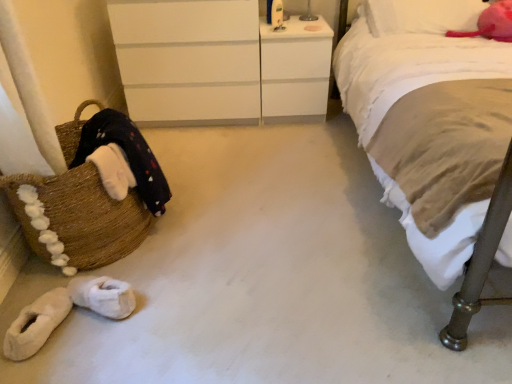
Question: Is white fluffy slippers at lower left, which is the second footwear in right-to-left order, not close to white fluffy slippers at lower left, placed as the 2th footwear when sorted from left to right?

Choices:
 (A) yes
 (B) no

Answer: (B)

Question: Is white fluffy slippers at lower left, the first footwear from the left, not inside white fluffy slippers at lower left, the first footwear positioned from the right?

Choices:
 (A) no
 (B) yes

Answer: (B)

Question: From the image's perspective, is white fluffy slippers at lower left, the first footwear from the left, over white fluffy slippers at lower left, placed as the 2th footwear when sorted from left to right?

Choices:
 (A) yes
 (B) no

Answer: (B)

Question: Is white fluffy slippers at lower left, the first footwear from the left, to the right of white fluffy slippers at lower left, the first footwear positioned from the right, from the viewer's perspective?

Choices:
 (A) no
 (B) yes

Answer: (A)

Question: Considering the relative sizes of white fluffy slippers at lower left, which is the second footwear in right-to-left order, and white fluffy slippers at lower left, placed as the 2th footwear when sorted from left to right, in the image provided, is white fluffy slippers at lower left, which is the second footwear in right-to-left order, smaller than white fluffy slippers at lower left, placed as the 2th footwear when sorted from left to right,?

Choices:
 (A) yes
 (B) no

Answer: (B)

Question: Is white fluffy slippers at lower left, which is the second footwear in right-to-left order, beside white fluffy slippers at lower left, placed as the 2th footwear when sorted from left to right?

Choices:
 (A) no
 (B) yes

Answer: (A)

Question: Is white glossy vanity at upper center further to camera compared to white fluffy slippers at lower left, placed as the 2th footwear when sorted from left to right?

Choices:
 (A) no
 (B) yes

Answer: (B)

Question: Considering the relative positions of white glossy vanity at upper center and white fluffy slippers at lower left, placed as the 2th footwear when sorted from left to right, in the image provided, is white glossy vanity at upper center to the right of white fluffy slippers at lower left, placed as the 2th footwear when sorted from left to right, from the viewer's perspective?

Choices:
 (A) yes
 (B) no

Answer: (A)

Question: From the image's perspective, is white glossy vanity at upper center located above white fluffy slippers at lower left, the first footwear positioned from the right?

Choices:
 (A) no
 (B) yes

Answer: (B)

Question: Does white glossy vanity at upper center have a greater height compared to white fluffy slippers at lower left, placed as the 2th footwear when sorted from left to right?

Choices:
 (A) yes
 (B) no

Answer: (A)

Question: Is white glossy vanity at upper center not close to white fluffy slippers at lower left, the first footwear positioned from the right?

Choices:
 (A) no
 (B) yes

Answer: (B)

Question: Is white glossy vanity at upper center positioned with its back to white fluffy slippers at lower left, the first footwear positioned from the right?

Choices:
 (A) yes
 (B) no

Answer: (B)

Question: Are white matte chest of drawers at upper center and brown woven basket at left making contact?

Choices:
 (A) no
 (B) yes

Answer: (A)